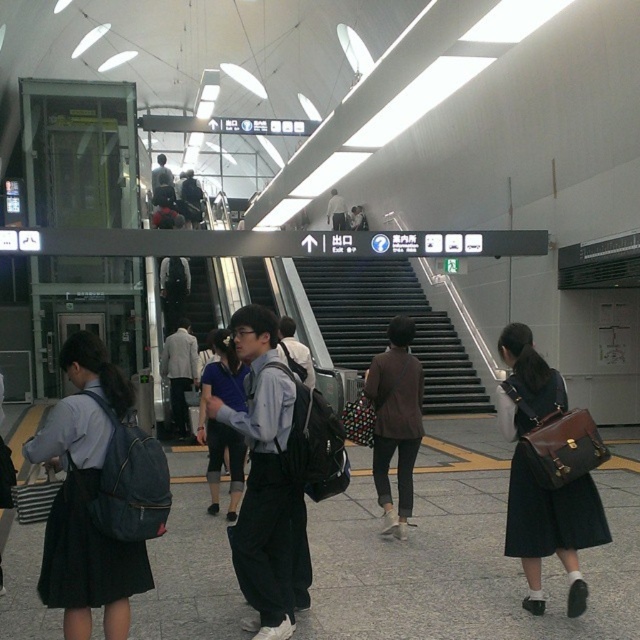
You are a maintenance worker assigned to inspect the black metal stairs at center in the train station. You are currently standing at the entrance of the station, which is 15 meters away from the stairs. Can you reach the stairs without moving closer?

The black metal stairs at center are 14.85 meters away from the camera, so if you are standing at the entrance 15 meters away, you are slightly farther than the required distance. You need to move about 15 centimeters closer to reach them.

You are a passenger in the train station and you see the matte brown leather bag at lower right and the denim backpack at left. Which one is positioned more to the right side of the scene?

The matte brown leather bag at lower right is positioned more to the right side of the scene than the denim backpack at left.

You are standing at the entrance of the train station and see the point marked at coordinates [547,470]. What object is located at this point?

The point at coordinates [547,470] marks the matte brown leather bag at lower right.